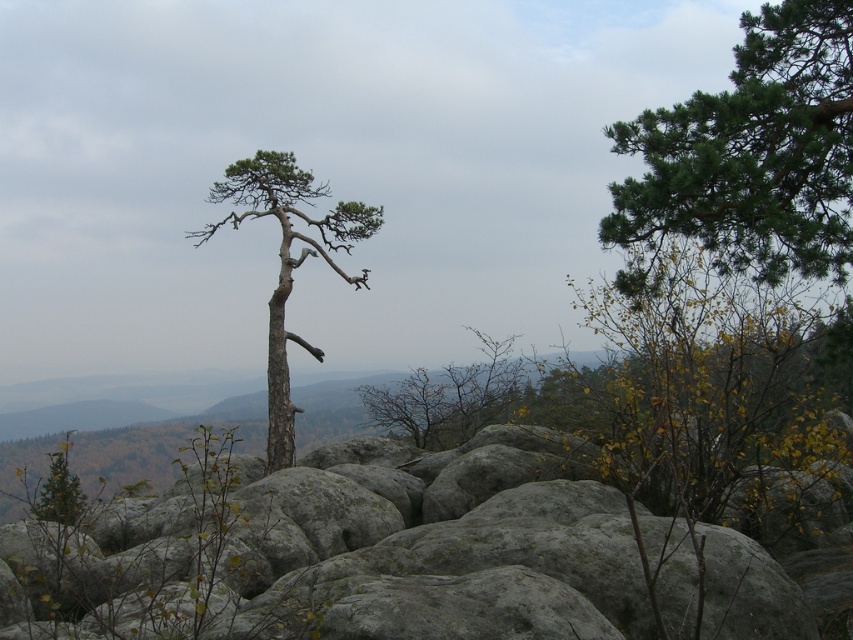
You are standing at the point with coordinates point (286, 250) and want to reach the point with coordinates point (770, 332). Which direction should you move to get closer to your destination?

You should move forward because point (770, 332) is in front of point (286, 250).